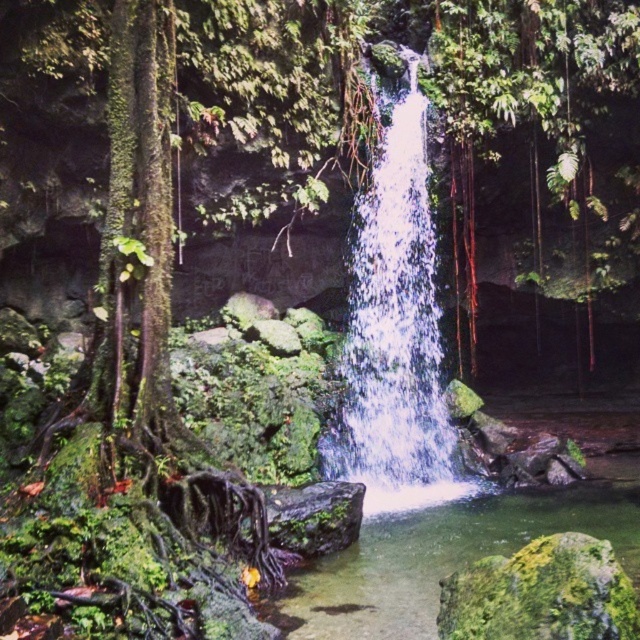
Question: Can you confirm if clear water at center is thinner than green mossy rock at center?

Choices:
 (A) yes
 (B) no

Answer: (B)

Question: Which of the following is the farthest from the observer?

Choices:
 (A) (384, 618)
 (B) (529, 586)

Answer: (A)

Question: Does white frothy water at center have a greater width compared to green mossy rock at center?

Choices:
 (A) yes
 (B) no

Answer: (A)

Question: Which point is closer to the camera?

Choices:
 (A) (388, 584)
 (B) (426, 472)

Answer: (A)

Question: Which object is positioned farthest from the white frothy water at center?

Choices:
 (A) clear water at center
 (B) green mossy rock at center

Answer: (B)

Question: Is white frothy water at center to the right of clear water at center from the viewer's perspective?

Choices:
 (A) no
 (B) yes

Answer: (A)